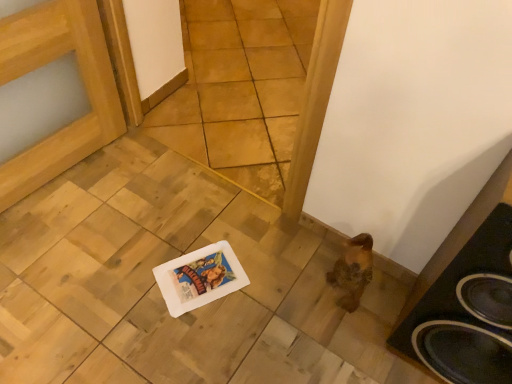
Question: Looking at their shapes, would you say black matte speaker at lower right is wider or thinner than natural wood tile at center?

Choices:
 (A) thin
 (B) wide

Answer: (B)

Question: Is black matte speaker at lower right bigger or smaller than natural wood tile at center?

Choices:
 (A) small
 (B) big

Answer: (A)

Question: From the image's perspective, is black matte speaker at lower right positioned above or below natural wood tile at center?

Choices:
 (A) above
 (B) below

Answer: (B)

Question: Choose the correct answer: Is natural wood tile at center inside black matte speaker at lower right or outside it?

Choices:
 (A) inside
 (B) outside

Answer: (B)

Question: Is point (188, 92) positioned closer to the camera than point (480, 241)?

Choices:
 (A) farther
 (B) closer

Answer: (A)

Question: Is natural wood tile at center taller or shorter than black matte speaker at lower right?

Choices:
 (A) short
 (B) tall

Answer: (B)

Question: Based on their positions, is natural wood tile at center located to the left or right of black matte speaker at lower right?

Choices:
 (A) right
 (B) left

Answer: (B)